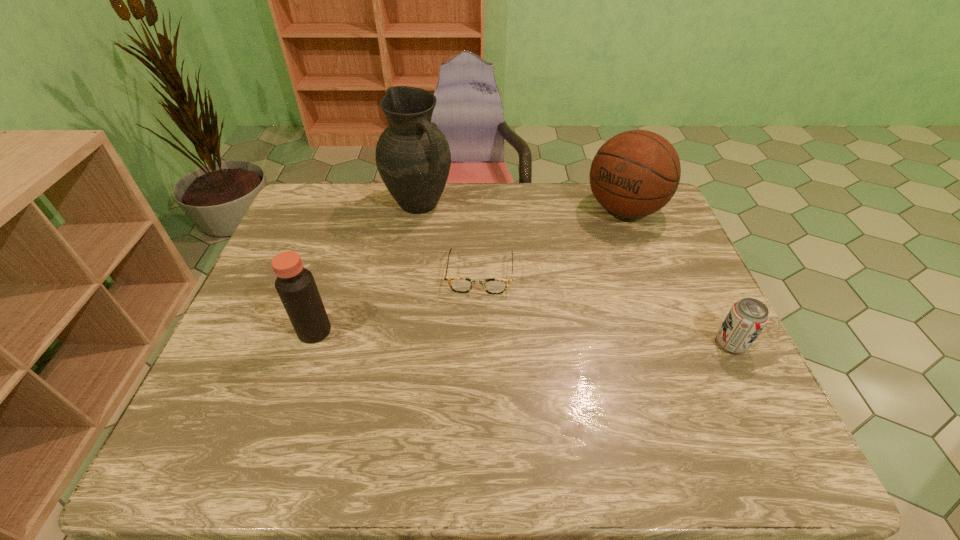
Locate an element on the screen. free space on the desktop that is between the leftmost object and the beer can and is positioned on the side of the pitcher with the handle is located at coordinates (568, 339).

Locate an element on the screen. vacant space on the desktop that is between the vinegar and the beer can and is positioned on the frame of the third farthest object is located at coordinates (474, 336).

Identify the location of vacant space on the desktop that is between the vinegar and the beer can and is positioned on the side with brand label of the basketball. The height and width of the screenshot is (540, 960). (493, 336).